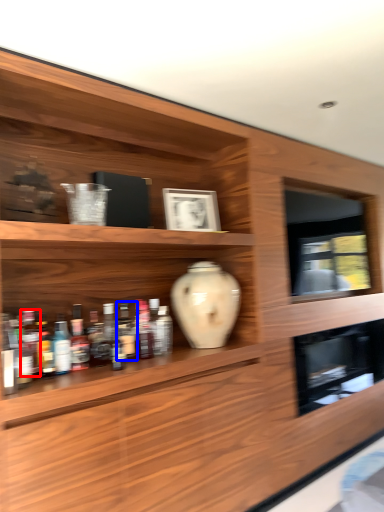
Question: Among these objects, which one is farthest to the camera, bottle (highlighted by a red box) or bottle (highlighted by a blue box)?

Choices:
 (A) bottle
 (B) bottle

Answer: (B)